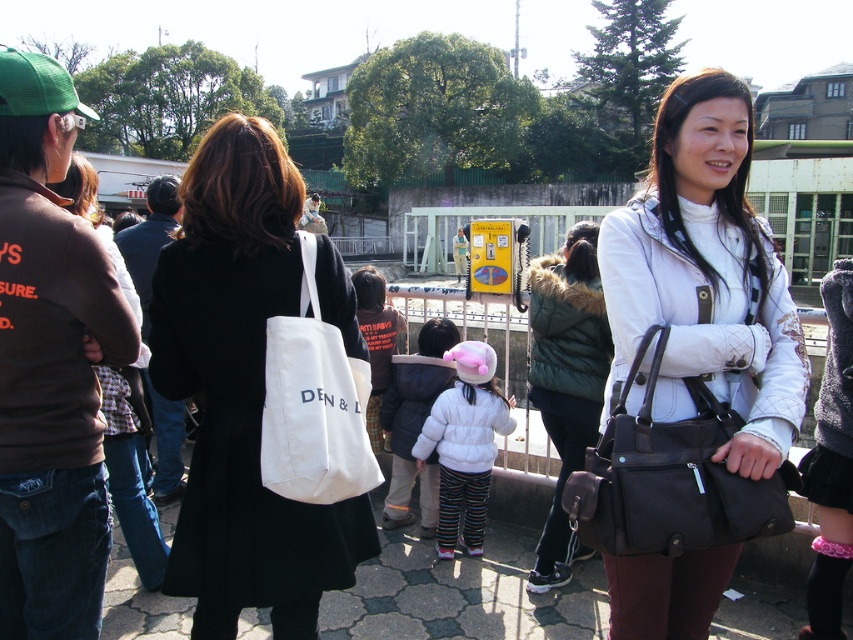
Question: Which object appears farthest from the camera in this image?

Choices:
 (A) white canvas tote at center
 (B) white canvas bag at center

Answer: (B)

Question: Which point is closer to the camera?

Choices:
 (A) green fabric baseball cap at upper left
 (B) white leather jacket at center

Answer: (B)

Question: Is black leather handbag at center-right below green fabric baseball cap at upper left?

Choices:
 (A) no
 (B) yes

Answer: (B)

Question: Does white fleece jacket at center have a greater width compared to pink plush baseball hat at center?

Choices:
 (A) no
 (B) yes

Answer: (B)

Question: Among these points, which one is nearest to the camera?

Choices:
 (A) (674, 419)
 (B) (434, 465)

Answer: (A)

Question: From the image, what is the correct spatial relationship of green fuzzy vest at center in relation to green fabric baseball cap at upper left?

Choices:
 (A) right
 (B) left

Answer: (A)